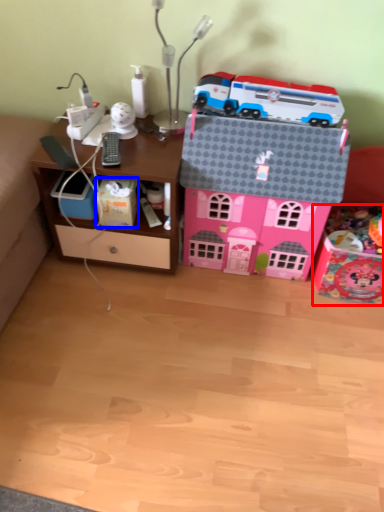
Question: Which of the following is the farthest to the observer, toy (highlighted by a red box) or cardboard box (highlighted by a blue box)?

Choices:
 (A) toy
 (B) cardboard box

Answer: (B)